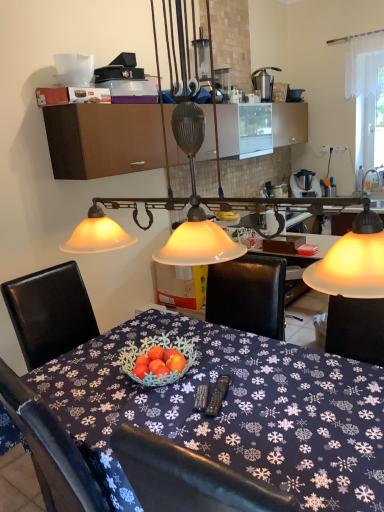
Question: Considering the relative sizes of blue fabric tablecloth at center and brushed metal faucet at upper right in the image provided, is blue fabric tablecloth at center thinner than brushed metal faucet at upper right?

Choices:
 (A) no
 (B) yes

Answer: (A)

Question: Is blue fabric tablecloth at center facing towards brushed metal faucet at upper right?

Choices:
 (A) no
 (B) yes

Answer: (A)

Question: Can you confirm if blue fabric tablecloth at center is bigger than brushed metal faucet at upper right?

Choices:
 (A) no
 (B) yes

Answer: (B)

Question: Can you confirm if blue fabric tablecloth at center is smaller than brushed metal faucet at upper right?

Choices:
 (A) yes
 (B) no

Answer: (B)

Question: From a real-world perspective, is blue fabric tablecloth at center below brushed metal faucet at upper right?

Choices:
 (A) no
 (B) yes

Answer: (B)

Question: Looking at the image, does metallic silver blender at right seem bigger or smaller compared to brown matte cabinet at upper center?

Choices:
 (A) big
 (B) small

Answer: (B)

Question: In terms of width, does metallic silver blender at right look wider or thinner when compared to brown matte cabinet at upper center?

Choices:
 (A) thin
 (B) wide

Answer: (A)

Question: Would you say metallic silver blender at right is inside or outside brown matte cabinet at upper center?

Choices:
 (A) outside
 (B) inside

Answer: (A)

Question: Is point (317, 186) closer or farther from the camera than point (104, 111)?

Choices:
 (A) farther
 (B) closer

Answer: (A)

Question: Based on their positions, is blue fabric tablecloth at center located to the left or right of metallic silver juicer at upper right?

Choices:
 (A) left
 (B) right

Answer: (A)

Question: Relative to metallic silver juicer at upper right, is blue fabric tablecloth at center in front or behind?

Choices:
 (A) front
 (B) behind

Answer: (A)

Question: From a real-world perspective, is blue fabric tablecloth at center positioned above or below metallic silver juicer at upper right?

Choices:
 (A) above
 (B) below

Answer: (B)

Question: Looking at their shapes, would you say blue fabric tablecloth at center is wider or thinner than metallic silver juicer at upper right?

Choices:
 (A) wide
 (B) thin

Answer: (A)

Question: From the image's perspective, is metallic silver juicer at upper right positioned above or below blue fabric tablecloth at center?

Choices:
 (A) above
 (B) below

Answer: (A)

Question: Looking at their shapes, would you say metallic silver juicer at upper right is wider or thinner than blue fabric tablecloth at center?

Choices:
 (A) thin
 (B) wide

Answer: (A)